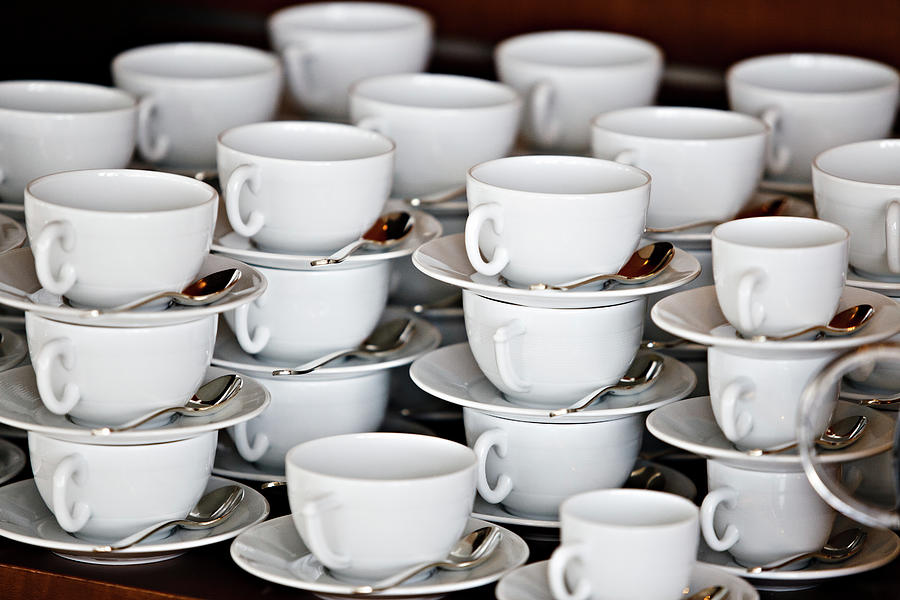
Where is `spoons on right side of cup, on saucer,  of bottom row of 3 cups`? Image resolution: width=900 pixels, height=600 pixels. spoons on right side of cup, on saucer,  of bottom row of 3 cups is located at coordinates (218, 496), (472, 532), (722, 590).